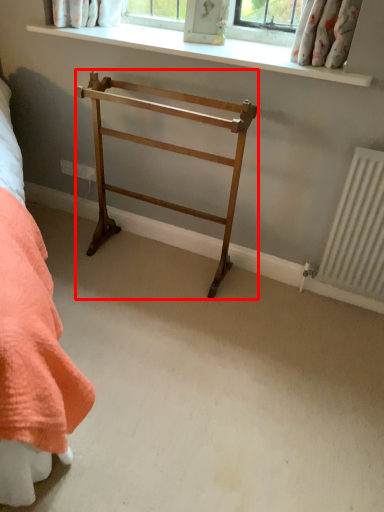
Question: From the image's perspective, where is furniture (annotated by the red box) located in relation to window sill in the image?

Choices:
 (A) above
 (B) below

Answer: (B)